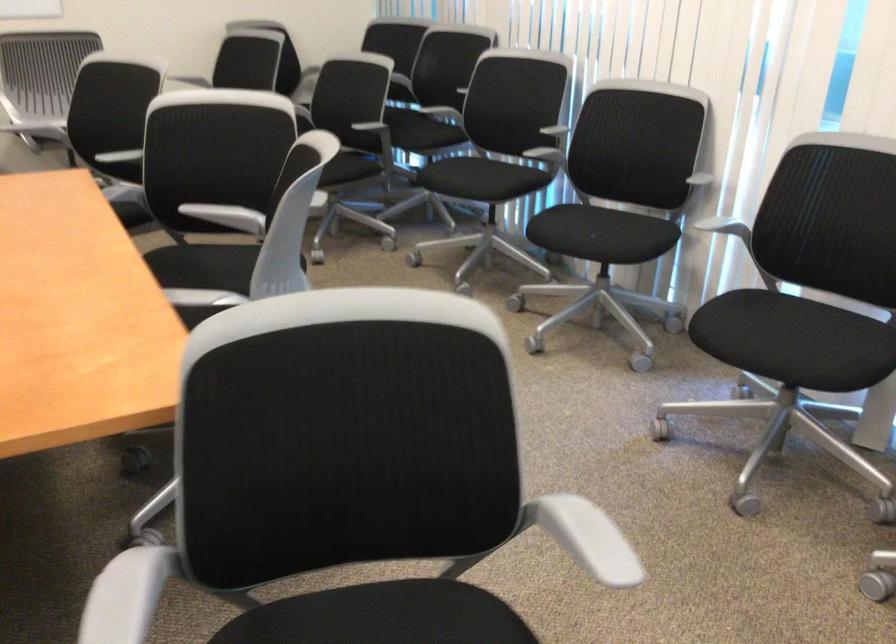
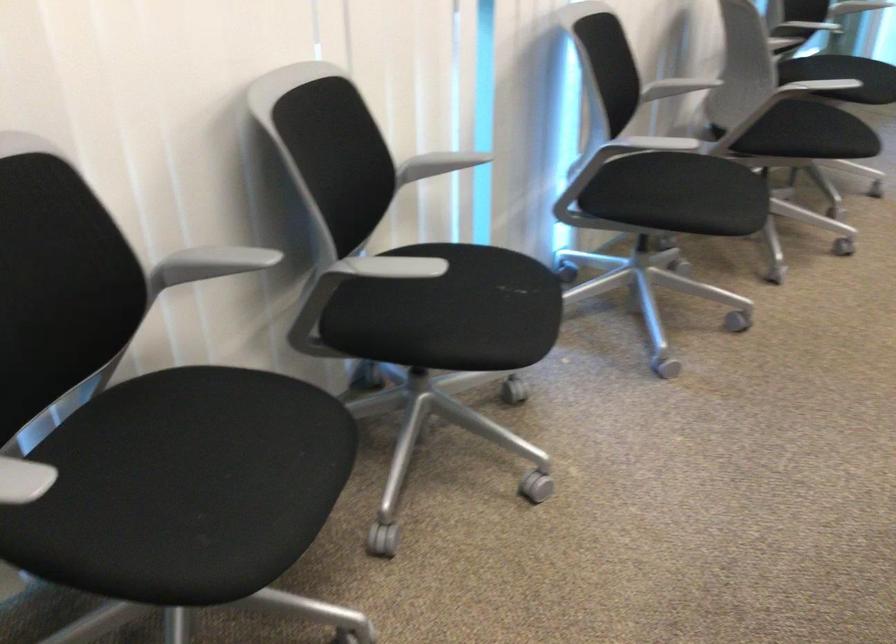
The point at (738, 319) is marked in the first image. Where is the corresponding point in the second image?

(679, 194)